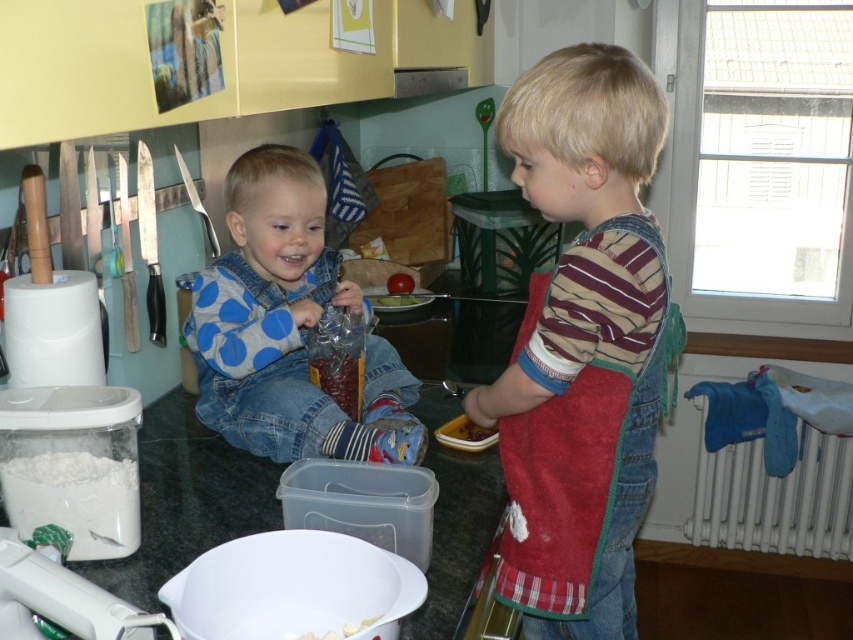
You are standing in the kitchen and want to take a photo of the blue dotted shirt at center. If your camera has a minimum focusing distance of 4 feet, will you be able to take a clear photo without moving closer?

The blue dotted shirt at center and camera are 4.36 feet apart from each other. Since the minimum focusing distance is 4 feet, the camera can focus at 4.36 feet, so yes, you can take a clear photo without moving closer.

You are a chef preparing to place a 15 cm wide bowl on the counter. You see the blue dotted shirt at center and the shiny plastic container at center. Which object should you avoid placing the bowl next to to prevent it from being too crowded?

The blue dotted shirt at center might be wider than the shiny plastic container at center, so you should avoid placing the bowl next to the blue dotted shirt at center to prevent overcrowding.